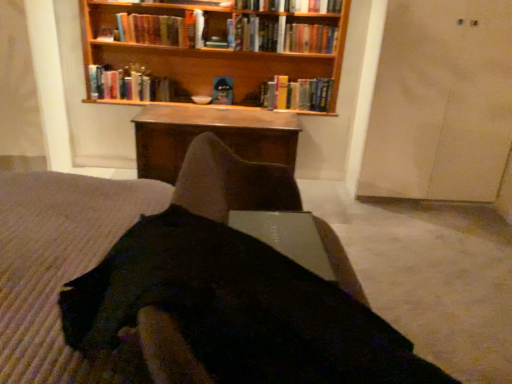
The image size is (512, 384). What are the coordinates of `empty space that is ontop of hardcover book at upper center, placed as the 5th book when sorted from left to right` in the screenshot? It's located at (283, 18).